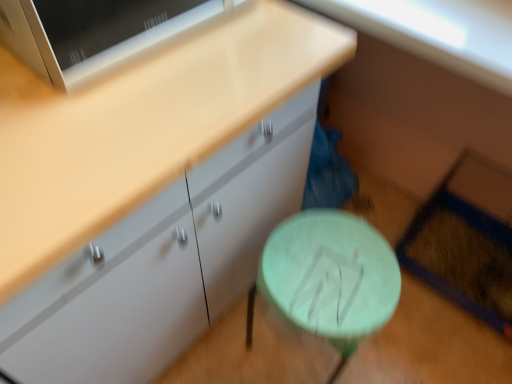
You are a GUI agent. You are given a task and a screenshot of the screen. Output one action in this format:
    pyautogui.click(x=<x>, y=<y>)
    Task: Click on the vacant space to the left of green matte table at lower center
    The image size is (512, 384).
    Given the screenshot: What is the action you would take?
    pyautogui.click(x=226, y=349)